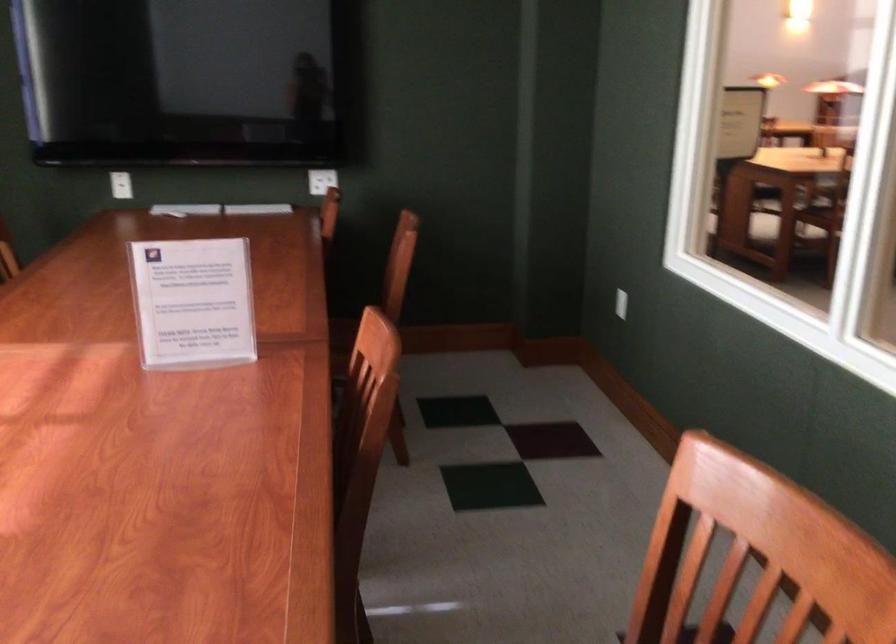
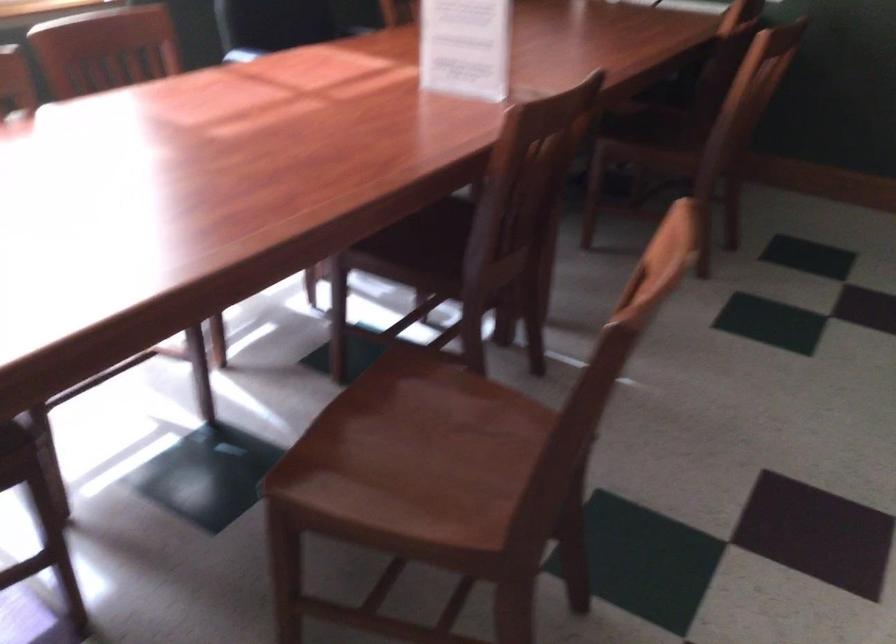
Based on the continuous images, in which direction is the camera rotating?

The rotation direction of the camera is left-down.